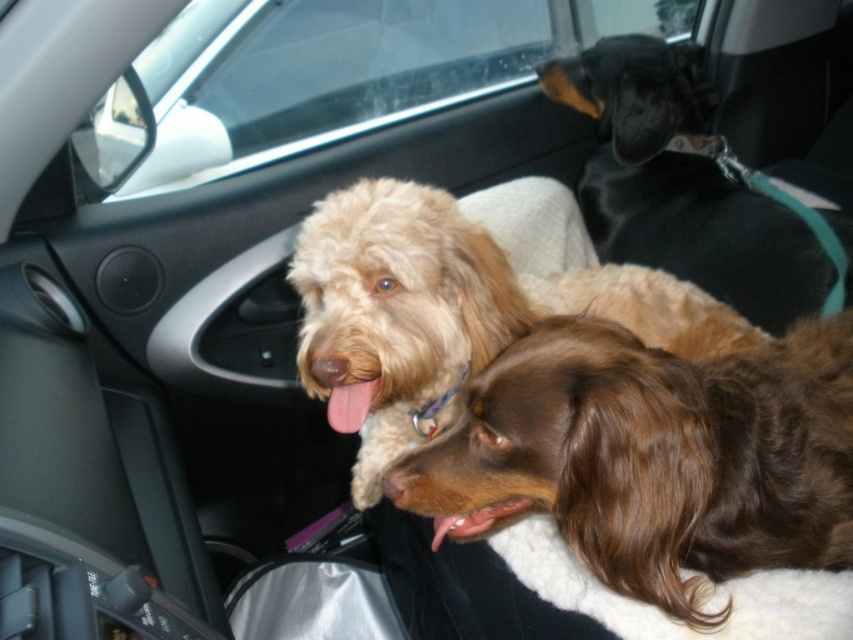
You are a dog owner who wants to ensure your dogs have enough space to move around in the car. Given that the transparent glass car window at upper center and the black leather dog at upper right are both present in the scene, which object takes up more space in the image?

The transparent glass car window at upper center takes up more space in the image than the black leather dog at upper right because it has a larger size compared to the black leather dog at upper right.

You are a passenger in the car and want to check the outside weather through the transparent glass car window at upper center. Where should you look on the car window to see the outside?

The transparent glass car window at upper center is located at point (x=351, y=70), so you should look at that point on the car window to see the outside.

Looking at this image, you are standing outside a car and want to see if you can reach a point inside the car located at coordinates point (515, 413) with your 60 cm long car retrieval tool. Can you reach it?

The distance between point (515, 413) and the camera is 78.48 centimeters. Since your tool is 60 cm long, you cannot reach the point as it is farther away than the tool length.